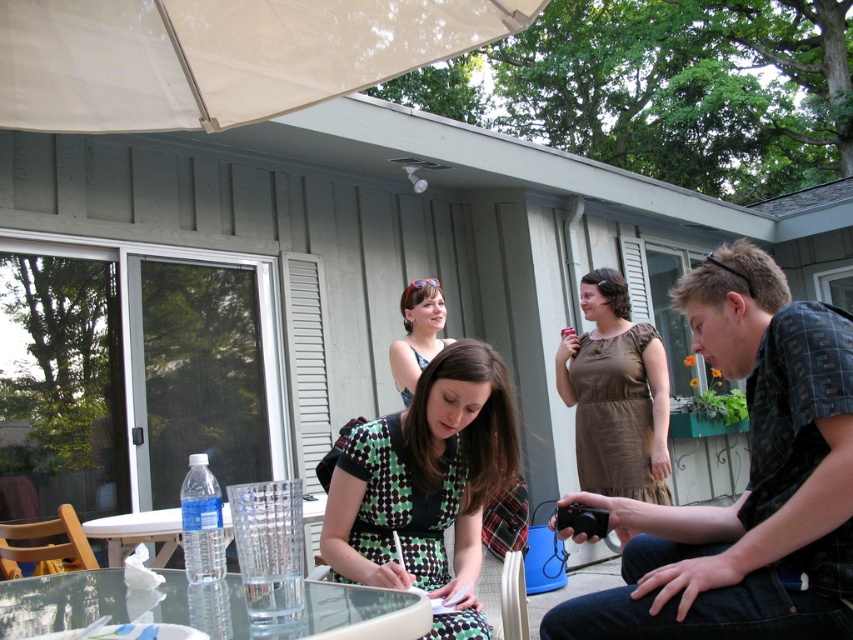
Question: Does patterned fabric shirt at center appear on the left side of transparent glass table at lower center?

Choices:
 (A) yes
 (B) no

Answer: (B)

Question: Which object is the farthest from the green checkered dress at center?

Choices:
 (A) clear glass table at center
 (B) patterned fabric shirt at center
 (C) brown satin dress at center

Answer: (C)

Question: Is clear glass table at center positioned in front of matte black tank top at center?

Choices:
 (A) no
 (B) yes

Answer: (B)

Question: Can you confirm if green checkered dress at center is positioned above matte black tank top at center?

Choices:
 (A) yes
 (B) no

Answer: (B)

Question: Which point is closer to the camera?

Choices:
 (A) clear glass table at center
 (B) transparent glass table at lower center

Answer: (B)

Question: Considering the real-world distances, which object is farthest from the patterned fabric shirt at center?

Choices:
 (A) transparent glass table at lower center
 (B) green checkered dress at center
 (C) clear glass table at center

Answer: (C)